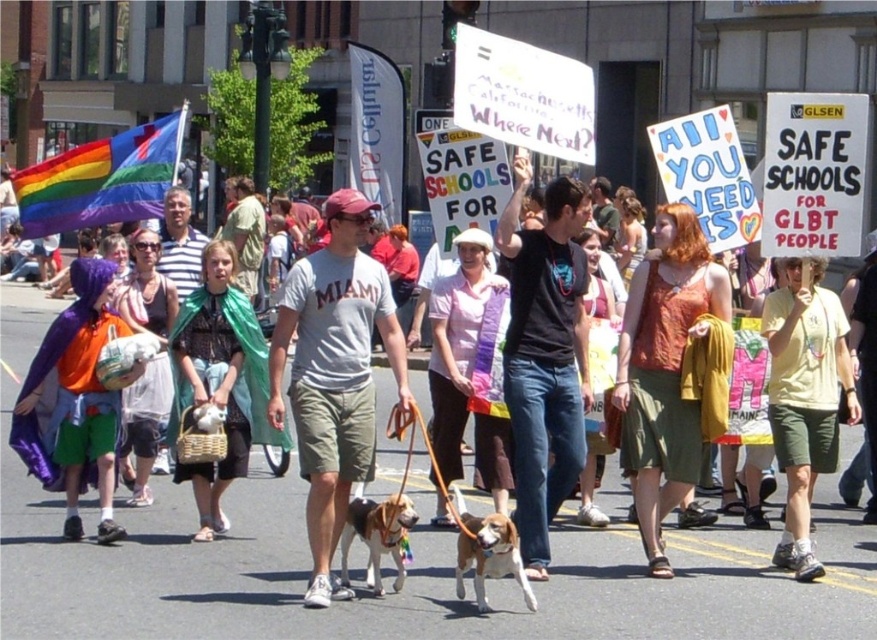
Does light brown fur at center appear under brown and white fur at center?

Incorrect, light brown fur at center is not positioned below brown and white fur at center.

Which is below, light brown fur at center or brown and white fur at center?

brown and white fur at center is below.

Find the location of a particular element. This screenshot has width=877, height=640. light brown fur at center is located at coordinates (378, 536).

Is gray cotton t-shirt at center positioned in front of black cotton t-shirt at center?

Yes, it is in front of black cotton t-shirt at center.

Does point (279, 317) come behind point (512, 275)?

No, (279, 317) is in front of (512, 275).

Is point (277, 317) more distant than point (561, 396)?

Yes.

Locate an element on the screen. This screenshot has height=640, width=877. gray cotton t-shirt at center is located at coordinates (334, 374).

Can you confirm if yellow cotton t-shirt at center is smaller than light brown fur at center?

No, yellow cotton t-shirt at center is not smaller than light brown fur at center.

Can you confirm if yellow cotton t-shirt at center is taller than light brown fur at center?

Correct, yellow cotton t-shirt at center is much taller as light brown fur at center.

Find the location of a particular element. The image size is (877, 640). yellow cotton t-shirt at center is located at coordinates (804, 396).

Locate an element on the screen. This screenshot has height=640, width=877. yellow cotton t-shirt at center is located at coordinates (804, 396).